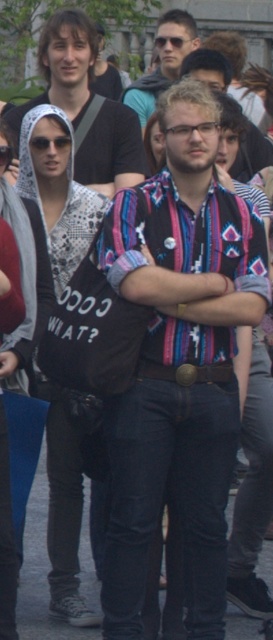
Question: Does patterned fabric shirt at center have a smaller size compared to matte black shirt at upper left?

Choices:
 (A) no
 (B) yes

Answer: (A)

Question: Which object appears farthest from the camera in this image?

Choices:
 (A) clear plastic glasses at center
 (B) matte black shirt at center
 (C) matte black shirt at upper left
 (D) patterned fabric shirt at center

Answer: (B)

Question: Does patterned fabric shirt at center have a larger size compared to black plastic goggles at upper center?

Choices:
 (A) no
 (B) yes

Answer: (B)

Question: Estimate the real-world distances between objects in this image. Which object is farther from the black matte sunglasses at upper left?

Choices:
 (A) matte black shirt at upper left
 (B) matte black shirt at center

Answer: (B)

Question: Does patterned fabric shirt at center appear over black plastic goggles at upper center?

Choices:
 (A) no
 (B) yes

Answer: (A)

Question: Which object appears closest to the camera in this image?

Choices:
 (A) matte black shirt at center
 (B) patterned fabric shirt at center

Answer: (B)